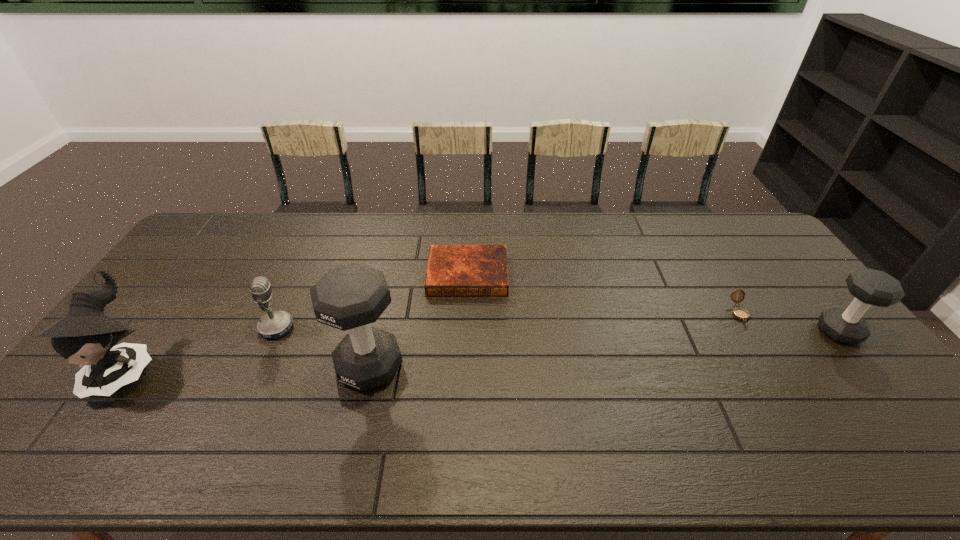
This screenshot has width=960, height=540. I want to click on free point between the farthest object and the shorter dumbbell, so pos(654,303).

I want to click on free space between the rightmost object and the fourth object from right to left, so click(x=605, y=349).

Find the location of a particular element. The height and width of the screenshot is (540, 960). free space between the compass and the shortest object is located at coordinates (603, 294).

Find the location of `empty space between the compass and the doll`. empty space between the compass and the doll is located at coordinates (434, 341).

I want to click on vacant region between the third object from left to right and the shortest object, so click(x=419, y=320).

Image resolution: width=960 pixels, height=540 pixels. I want to click on vacant space in between the left dumbbell and the rightmost object, so click(605, 349).

Identify which object is the second closest to the farthest object. Please provide its 2D coordinates. Your answer should be formatted as a tuple, i.e. [(x, y)], where the tuple contains the x and y coordinates of a point satisfying the conditions above.

[(276, 324)]

Select which object appears as the third closest to the rightmost object. Please provide its 2D coordinates. Your answer should be formatted as a tuple, i.e. [(x, y)], where the tuple contains the x and y coordinates of a point satisfying the conditions above.

[(350, 297)]

Find the location of a particular element. free point that satisfies the following two spatial constraints: 1. on the spine side of the farthest object; 2. on the left side of the right dumbbell is located at coordinates (466, 332).

Identify the location of free space that satisfies the following two spatial constraints: 1. on the spine side of the shortest object; 2. on the right side of the rightmost object. (466, 332).